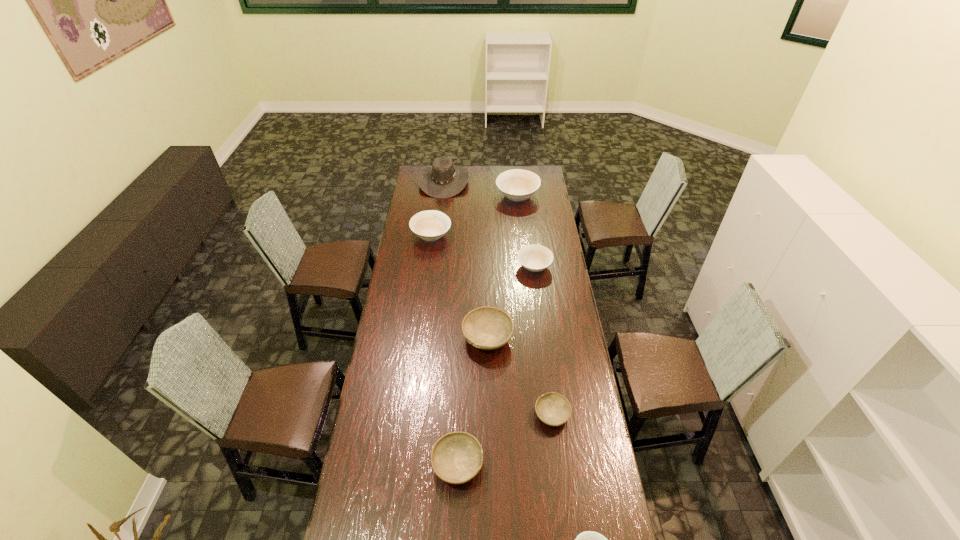
Find the location of `beige bowl that is the second closest to the leftmost beige bowl`. beige bowl that is the second closest to the leftmost beige bowl is located at coordinates (535, 258).

Identify which beige bowl is the closest to the biggest beige bowl. Please provide its 2D coordinates. Your answer should be formatted as a tuple, i.e. [(x, y)], where the tuple contains the x and y coordinates of a point satisfying the conditions above.

[(430, 225)]

Select which gray bowl appears as the second closest to the fifth nearest object. Please provide its 2D coordinates. Your answer should be formatted as a tuple, i.e. [(x, y)], where the tuple contains the x and y coordinates of a point satisfying the conditions above.

[(553, 409)]

Point out which gray bowl is positioned as the nearest to the cowboy hat. Please provide its 2D coordinates. Your answer should be formatted as a tuple, i.e. [(x, y)], where the tuple contains the x and y coordinates of a point satisfying the conditions above.

[(488, 328)]

Where is `vacant space that satisfies the following two spatial constraints: 1. on the front side of the farthest gray bowl; 2. on the right side of the third smallest beige bowl`? vacant space that satisfies the following two spatial constraints: 1. on the front side of the farthest gray bowl; 2. on the right side of the third smallest beige bowl is located at coordinates (419, 338).

Where is `free region that satisfies the following two spatial constraints: 1. on the front-facing side of the tallest object; 2. on the right side of the second nearest bowl`? The image size is (960, 540). free region that satisfies the following two spatial constraints: 1. on the front-facing side of the tallest object; 2. on the right side of the second nearest bowl is located at coordinates (413, 464).

Locate an element on the screen. The image size is (960, 540). vacant region that satisfies the following two spatial constraints: 1. on the front-facing side of the tallest object; 2. on the left side of the fifth nearest bowl is located at coordinates (434, 267).

The image size is (960, 540). I want to click on vacant space that satisfies the following two spatial constraints: 1. on the back side of the sixth farthest bowl; 2. on the right side of the farthest beige bowl, so click(x=468, y=196).

At what (x,y) coordinates should I click in order to perform the action: click on vacant position in the image that satisfies the following two spatial constraints: 1. on the front-facing side of the second smallest gray bowl; 2. on the left side of the cowboy hat. Please return your answer as a coordinate pair (x, y). Image resolution: width=960 pixels, height=540 pixels. Looking at the image, I should click on (413, 464).

The height and width of the screenshot is (540, 960). Identify the location of free point that satisfies the following two spatial constraints: 1. on the back side of the nearest gray bowl; 2. on the right side of the fourth farthest bowl. (462, 338).